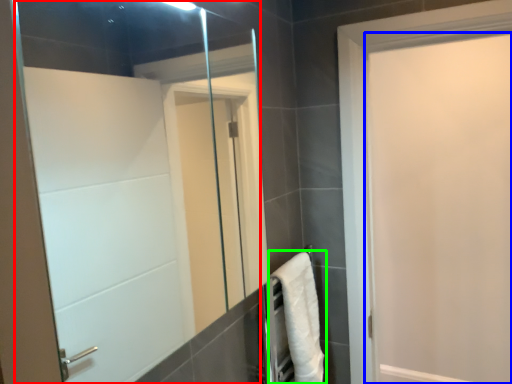
Question: Based on their relative distances, which object is nearer to mirror (highlighted by a red box)? Choose from door (highlighted by a blue box) and bath towel (highlighted by a green box).

Choices:
 (A) door
 (B) bath towel

Answer: (B)